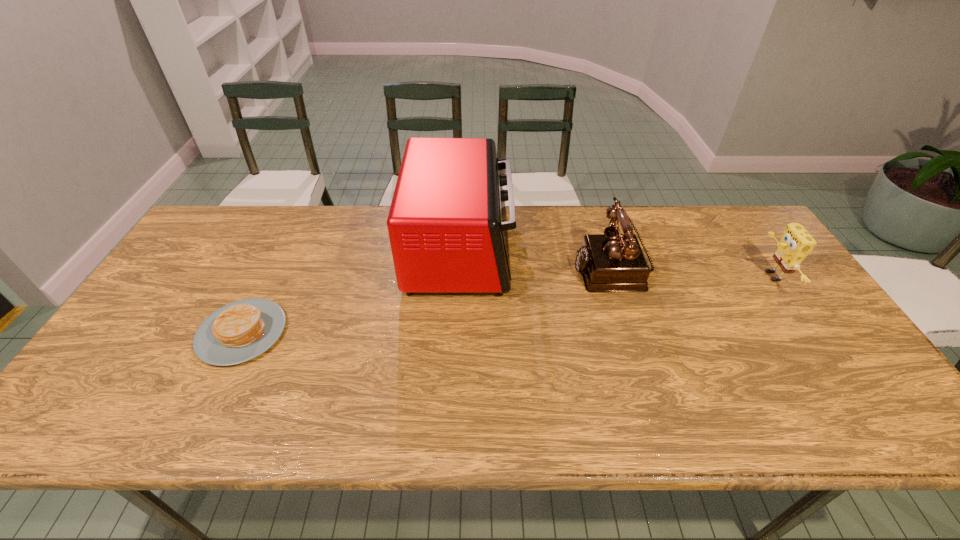
You are a GUI agent. You are given a task and a screenshot of the screen. Output one action in this format:
    pyautogui.click(x=<x>, y=<y>)
    Task: Click on the free space located on the dial of the second tallest object
    
    Given the screenshot: What is the action you would take?
    pyautogui.click(x=516, y=267)

Find the location of a particular element. The width and height of the screenshot is (960, 540). vacant space situated 0.330m on the dial of the second tallest object is located at coordinates (463, 267).

I want to click on vacant space situated 0.390m on the face of the sponge, so click(627, 276).

Identify the location of vacant position located on the face of the sponge. (712, 276).

In order to click on vacant region located on the face of the sponge in this screenshot , I will do `click(712, 276)`.

Identify the location of vacant space located 0.100m on the front of the pancake. The height and width of the screenshot is (540, 960). (205, 407).

Image resolution: width=960 pixels, height=540 pixels. I want to click on toaster oven present at the far edge, so click(447, 224).

The height and width of the screenshot is (540, 960). I want to click on telephone that is at the far edge, so click(611, 262).

This screenshot has width=960, height=540. Find the location of `object that is at the right edge`. object that is at the right edge is located at coordinates (796, 243).

Identify the location of free point at the far edge. (528, 231).